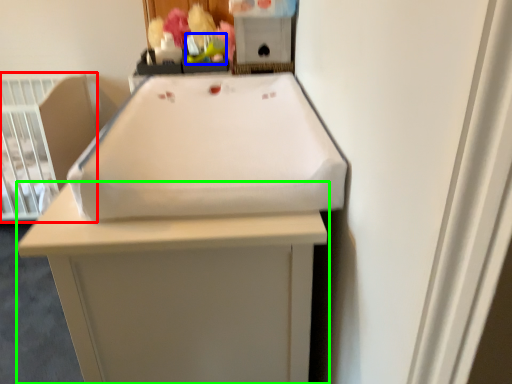
Question: Which object is positioned closest to infant bed (highlighted by a red box)? Select from toy (highlighted by a blue box) and furniture (highlighted by a green box).

Choices:
 (A) toy
 (B) furniture

Answer: (A)